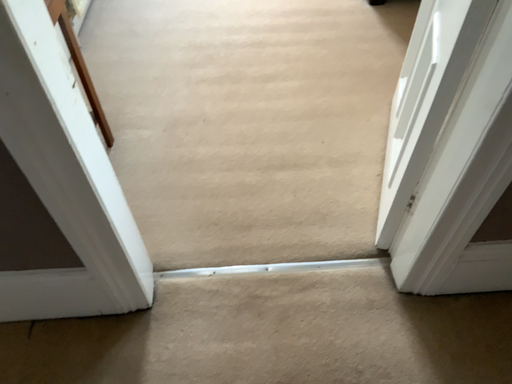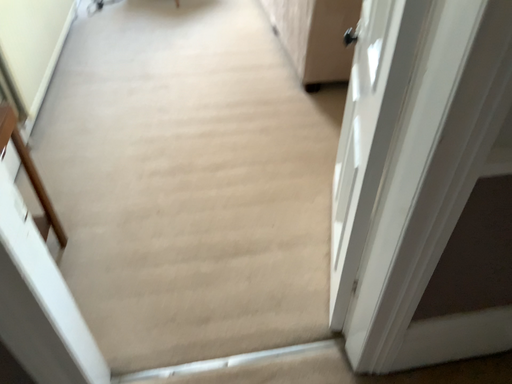
Question: How did the camera likely rotate when shooting the video?

Choices:
 (A) rotated upward
 (B) rotated downward

Answer: (A)